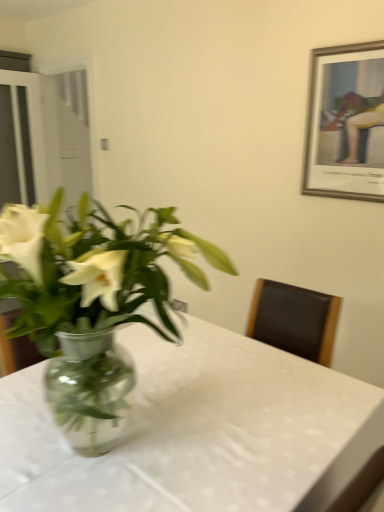
Question: Can you confirm if transparent glass door at left, arranged as the first glass door when viewed from the left, is shorter than transparent glass table at center?

Choices:
 (A) yes
 (B) no

Answer: (B)

Question: Is transparent glass door at left, the second glass door viewed from the right, bigger than transparent glass table at center?

Choices:
 (A) yes
 (B) no

Answer: (B)

Question: From the image's perspective, is transparent glass door at left, arranged as the first glass door when viewed from the left, under transparent glass table at center?

Choices:
 (A) yes
 (B) no

Answer: (B)

Question: Is transparent glass door at left, arranged as the first glass door when viewed from the left, outside of transparent glass table at center?

Choices:
 (A) no
 (B) yes

Answer: (B)

Question: Does transparent glass door at left, the second glass door viewed from the right, have a greater height compared to transparent glass table at center?

Choices:
 (A) yes
 (B) no

Answer: (A)

Question: From the image's perspective, relative to silver/golden frame at upper right, is transparent glass table at center above or below?

Choices:
 (A) below
 (B) above

Answer: (A)

Question: In terms of width, does transparent glass table at center look wider or thinner when compared to silver/golden frame at upper right?

Choices:
 (A) thin
 (B) wide

Answer: (B)

Question: Considering the positions of transparent glass table at center and silver/golden frame at upper right in the image, is transparent glass table at center taller or shorter than silver/golden frame at upper right?

Choices:
 (A) short
 (B) tall

Answer: (B)

Question: Visually, is transparent glass table at center positioned to the left or to the right of silver/golden frame at upper right?

Choices:
 (A) left
 (B) right

Answer: (A)

Question: From a real-world perspective, relative to transparent glass door at left, the second glass door viewed from the right, is transparent glass table at center vertically above or below?

Choices:
 (A) below
 (B) above

Answer: (A)

Question: In terms of height, does transparent glass table at center look taller or shorter compared to transparent glass door at left, the second glass door viewed from the right?

Choices:
 (A) short
 (B) tall

Answer: (A)

Question: From the image's perspective, is transparent glass table at center positioned above or below transparent glass door at left, the second glass door viewed from the right?

Choices:
 (A) above
 (B) below

Answer: (B)

Question: Which is correct: transparent glass table at center is inside transparent glass door at left, arranged as the first glass door when viewed from the left, or outside of it?

Choices:
 (A) inside
 (B) outside

Answer: (B)

Question: Considering the positions of clear glass vase at center and silver/golden frame at upper right in the image, is clear glass vase at center wider or thinner than silver/golden frame at upper right?

Choices:
 (A) wide
 (B) thin

Answer: (A)

Question: Relative to silver/golden frame at upper right, is clear glass vase at center in front or behind?

Choices:
 (A) front
 (B) behind

Answer: (A)